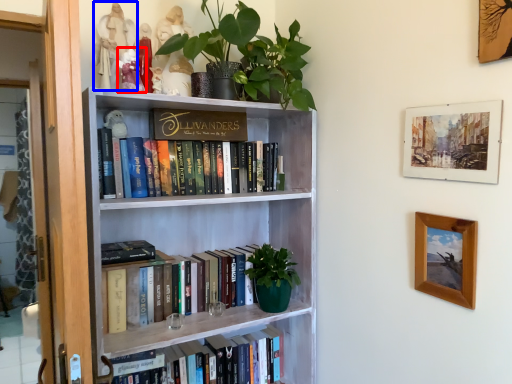
Question: Which of the following is the farthest to the observer, toy (highlighted by a red box) or toy (highlighted by a blue box)?

Choices:
 (A) toy
 (B) toy

Answer: (B)